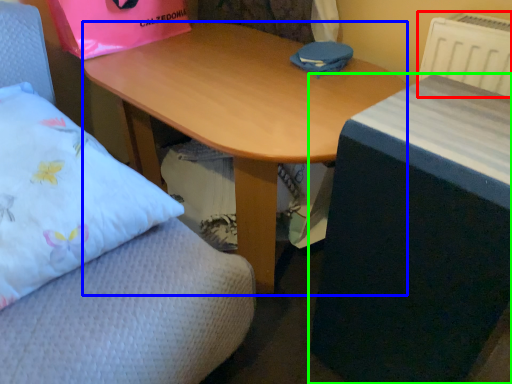
Question: Which object is the closest to the radiator (highlighted by a red box)? Choose among these: desk (highlighted by a blue box) or table (highlighted by a green box).

Choices:
 (A) desk
 (B) table

Answer: (B)